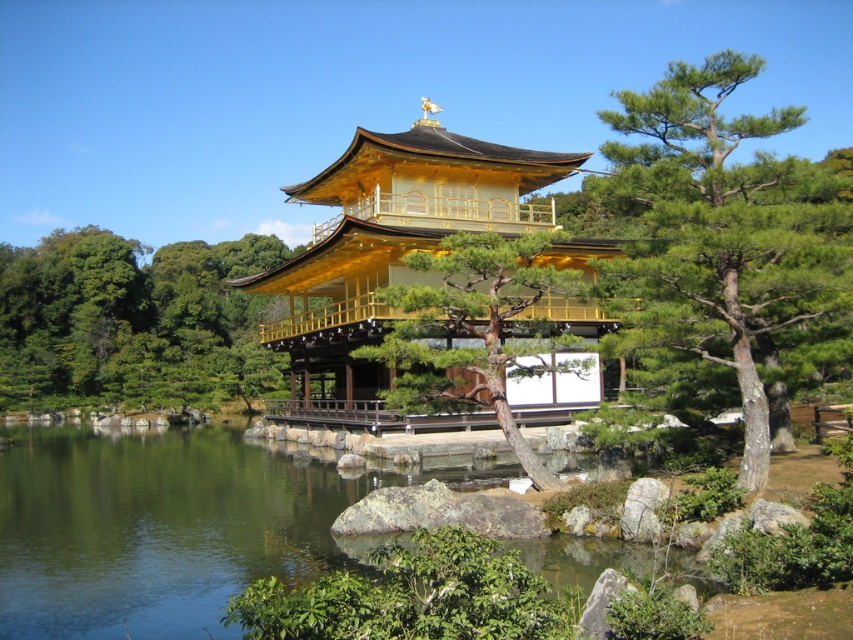
Question: Does green textured pine tree at upper right appear on the left side of smooth bark pine tree at center?

Choices:
 (A) yes
 (B) no

Answer: (B)

Question: Which is farther from the green textured pine tree at upper right?

Choices:
 (A) smooth bark pine tree at center
 (B) golden polished wood temple at center
 (C) green leafy tree at center

Answer: (C)

Question: Which object is positioned farthest from the green leafy tree at center?

Choices:
 (A) green textured pine tree at upper right
 (B) golden polished wood temple at center
 (C) smooth bark pine tree at center

Answer: (C)

Question: Is golden polished wood temple at center positioned at the back of green leafy tree at center?

Choices:
 (A) no
 (B) yes

Answer: (A)

Question: Can you confirm if green textured pine tree at upper right is bigger than golden polished wood temple at center?

Choices:
 (A) yes
 (B) no

Answer: (B)

Question: Among these points, which one is farthest from the camera?

Choices:
 (A) [x=343, y=296]
 (B) [x=682, y=116]
 (C) [x=451, y=353]
 (D) [x=207, y=330]

Answer: (D)